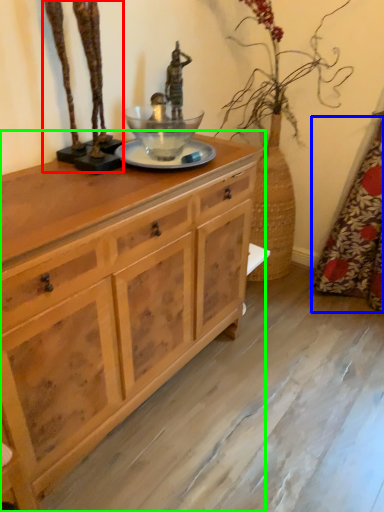
Question: Which object is the closest to the bronze statue (highlighted by a red box)? Choose among these: curtain (highlighted by a blue box) or chest of drawers (highlighted by a green box).

Choices:
 (A) curtain
 (B) chest of drawers

Answer: (B)